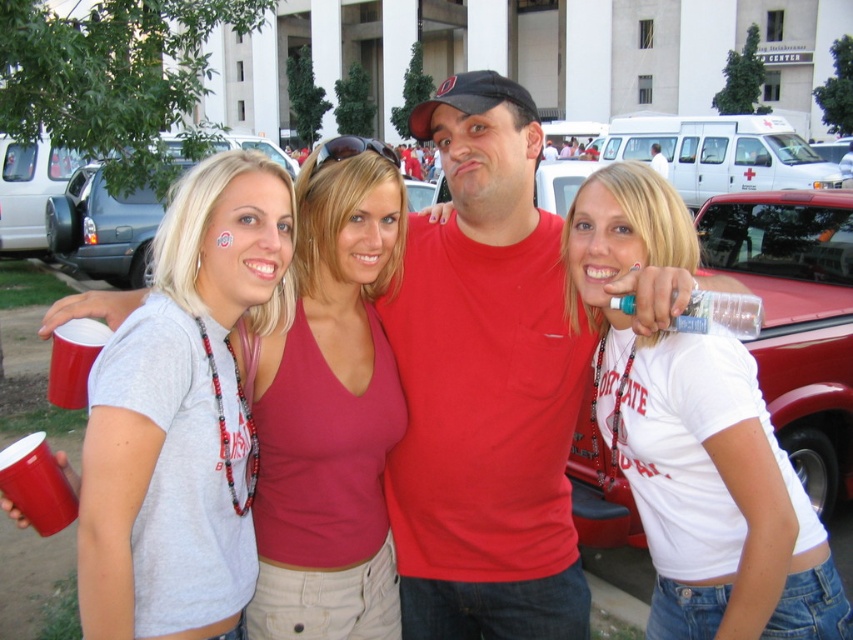
Question: Among these points, which one is farthest from the camera?

Choices:
 (A) (357, 332)
 (B) (67, 198)
 (C) (288, 396)

Answer: (B)

Question: Among these points, which one is nearest to the camera?

Choices:
 (A) coord(305,252)
 (B) coord(410,561)
 (C) coord(86,208)

Answer: (A)

Question: Is matte gray t-shirt at center to the left of metallic silver car at left from the viewer's perspective?

Choices:
 (A) yes
 (B) no

Answer: (B)

Question: Is matte red t-shirt at center positioned behind matte gray t-shirt at center?

Choices:
 (A) no
 (B) yes

Answer: (B)

Question: Among these points, which one is nearest to the camera?

Choices:
 (A) (346, 420)
 (B) (68, 248)
 (C) (471, 93)

Answer: (A)

Question: Can you confirm if matte red t-shirt at center is positioned below matte gray t-shirt at center?

Choices:
 (A) no
 (B) yes

Answer: (A)